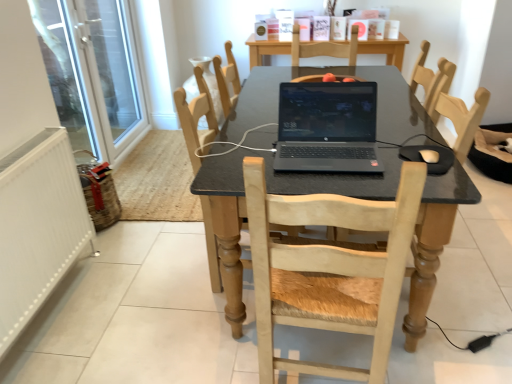
Question: In the image, is black matte laptop at center positioned in front of or behind white textured radiator at left?

Choices:
 (A) behind
 (B) front

Answer: (A)

Question: Considering the positions of point (343, 135) and point (54, 198), is point (343, 135) closer or farther from the camera than point (54, 198)?

Choices:
 (A) closer
 (B) farther

Answer: (A)

Question: Estimate the real-world distances between objects in this image. Which object is farther from the matte black table at center?

Choices:
 (A) white matte mouse at lower right
 (B) wooden chair at upper center, arranged as the third chair when viewed from the front
 (C) light wood chair at center, the 3th chair positioned from the back
 (D) white glass screen door at left
 (E) black matte laptop at center

Answer: (D)

Question: Estimate the real-world distances between objects in this image. Which object is closer to the white matte mouse at lower right?

Choices:
 (A) white textured radiator at left
 (B) black matte laptop at center
 (C) wooden chair at upper center, the 1th chair from the back
 (D) white glass screen door at left
 (E) matte black table at center

Answer: (B)